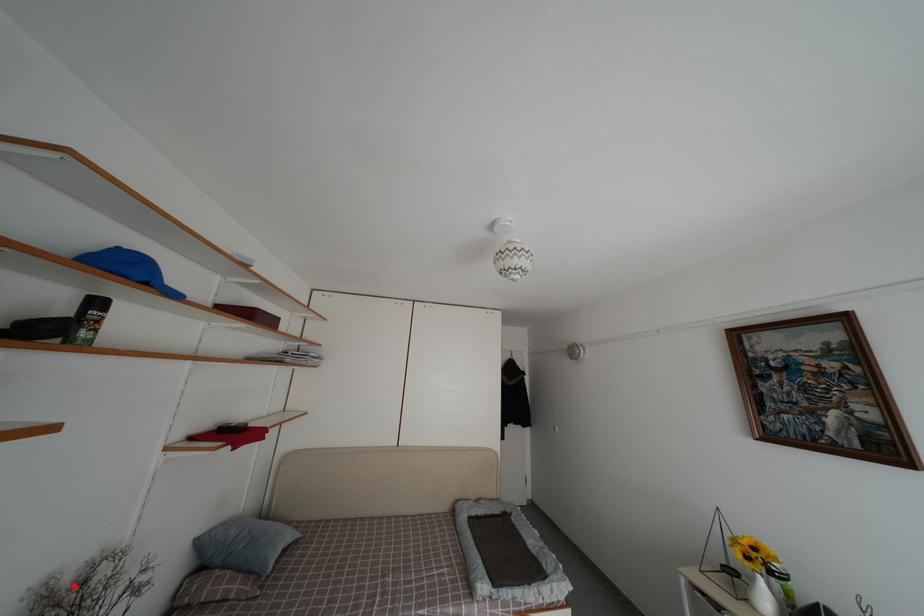
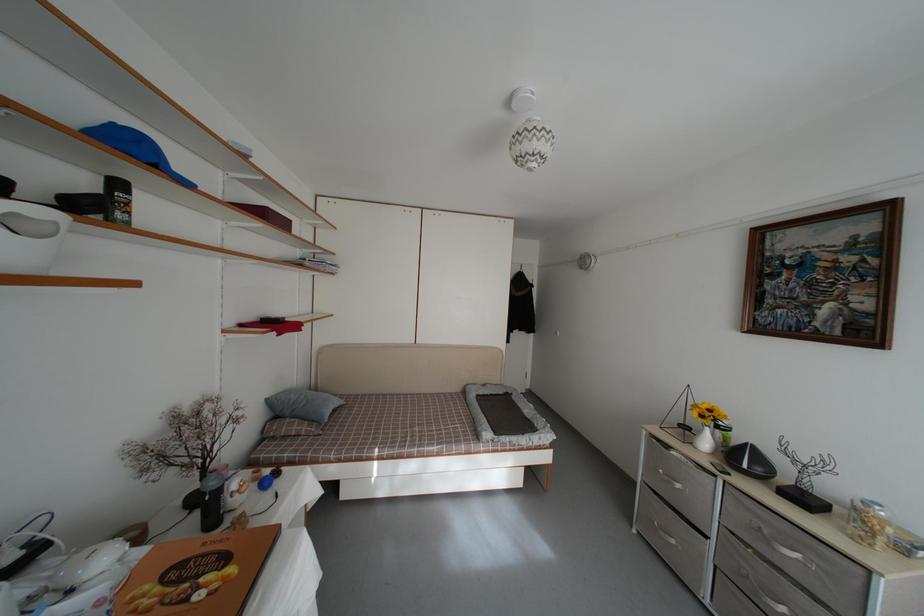
In the second image, find the point that corresponds to the highlighted location in the first image.

(192, 416)